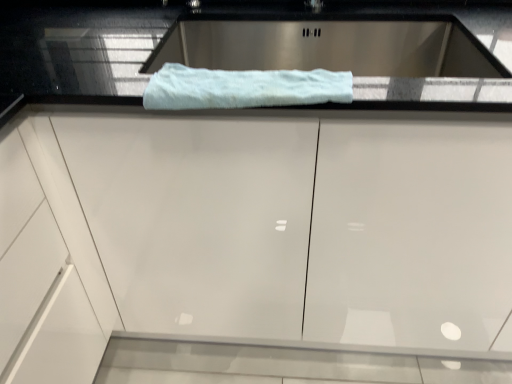
The width and height of the screenshot is (512, 384). Describe the element at coordinates (256, 243) in the screenshot. I see `white glossy cabinet at center` at that location.

In order to face white glossy cabinet at center, should I rotate leftwards or rightwards?

Rotate right and turn 1.152 degrees.

At what (x,y) coordinates should I click in order to perform the action: click on white glossy cabinet at center. Please return your answer as a coordinate pair (x, y). The height and width of the screenshot is (384, 512). Looking at the image, I should click on (256, 243).

Measure the distance between white glossy cabinet at center and camera.

white glossy cabinet at center is 28.76 inches away from camera.

This screenshot has width=512, height=384. What do you see at coordinates (243, 88) in the screenshot?
I see `white fluffy towel at center` at bounding box center [243, 88].

Where is `white fluffy towel at center`? white fluffy towel at center is located at coordinates (243, 88).

I want to click on white glossy cabinet at center, so click(256, 243).

Considering the relative positions of white glossy cabinet at center and white fluffy towel at center in the image provided, is white glossy cabinet at center to the right of white fluffy towel at center from the viewer's perspective?

Yes.

Which object is further away from the camera, white glossy cabinet at center or white fluffy towel at center?

white fluffy towel at center is behind.

Is point (108, 113) in front of point (230, 88)?

No.

From the image's perspective, is white glossy cabinet at center positioned above or below white fluffy towel at center?

From the image's perspective, white glossy cabinet at center appears below white fluffy towel at center.

From a real-world perspective, is white glossy cabinet at center beneath white fluffy towel at center?

Correct, in the physical world, white glossy cabinet at center is lower than white fluffy towel at center.

Which of these two, white glossy cabinet at center or white fluffy towel at center, is thinner?

With smaller width is white fluffy towel at center.

Does white glossy cabinet at center have a greater height compared to white fluffy towel at center?

Yes.

Is white glossy cabinet at center smaller than white fluffy towel at center?

Actually, white glossy cabinet at center might be larger than white fluffy towel at center.

Does white glossy cabinet at center contain white fluffy towel at center?

Indeed, white fluffy towel at center is located within white glossy cabinet at center.

Is white glossy cabinet at center beside white fluffy towel at center?

No, white glossy cabinet at center is not beside white fluffy towel at center.

Is white glossy cabinet at center oriented towards white fluffy towel at center?

No.

Can you tell me how much white glossy cabinet at center and white fluffy towel at center differ in facing direction?

1.29 degrees separate the facing orientations of white glossy cabinet at center and white fluffy towel at center.

At what (x,y) coordinates should I click in order to perform the action: click on bath towel above the white glossy cabinet at center (from the image's perspective). Please return your answer as a coordinate pair (x, y). Looking at the image, I should click on (243, 88).

Considering the relative positions of white fluffy towel at center and white glossy cabinet at center in the image provided, is white fluffy towel at center to the right of white glossy cabinet at center from the viewer's perspective?

No, white fluffy towel at center is not to the right of white glossy cabinet at center.

Considering the relative positions of white fluffy towel at center and white glossy cabinet at center in the image provided, is white fluffy towel at center behind white glossy cabinet at center?

Yes.

Does point (321, 86) come in front of point (470, 333)?

Yes, it is.

From the image's perspective, which is below, white fluffy towel at center or white glossy cabinet at center?

white glossy cabinet at center appears lower in the image.

From a real-world perspective, is white fluffy towel at center positioned above or below white glossy cabinet at center?

From a real-world perspective, white fluffy towel at center is physically above white glossy cabinet at center.

Considering the relative sizes of white fluffy towel at center and white glossy cabinet at center in the image provided, is white fluffy towel at center wider than white glossy cabinet at center?

In fact, white fluffy towel at center might be narrower than white glossy cabinet at center.

Which of these two, white fluffy towel at center or white glossy cabinet at center, stands taller?

white glossy cabinet at center is taller.

Is white fluffy towel at center bigger or smaller than white glossy cabinet at center?

white fluffy towel at center is smaller than white glossy cabinet at center.

Is white fluffy towel at center completely or partially outside of white glossy cabinet at center?

No, white fluffy towel at center is not entirely external to white glossy cabinet at center.

Is white fluffy towel at center touching white glossy cabinet at center?

No, white fluffy towel at center is not beside white glossy cabinet at center.

Is white fluffy towel at center looking in the opposite direction of white glossy cabinet at center?

Correct, white fluffy towel at center is looking away from white glossy cabinet at center.

How far apart are white fluffy towel at center and white glossy cabinet at center?

A distance of 14.35 inches exists between white fluffy towel at center and white glossy cabinet at center.

I want to click on bath towel on the left of white glossy cabinet at center, so click(243, 88).

The height and width of the screenshot is (384, 512). Identify the location of bath towel located above the white glossy cabinet at center (from the image's perspective). (243, 88).

Where is `cabinetry in front of the white fluffy towel at center`? cabinetry in front of the white fluffy towel at center is located at coordinates (256, 243).